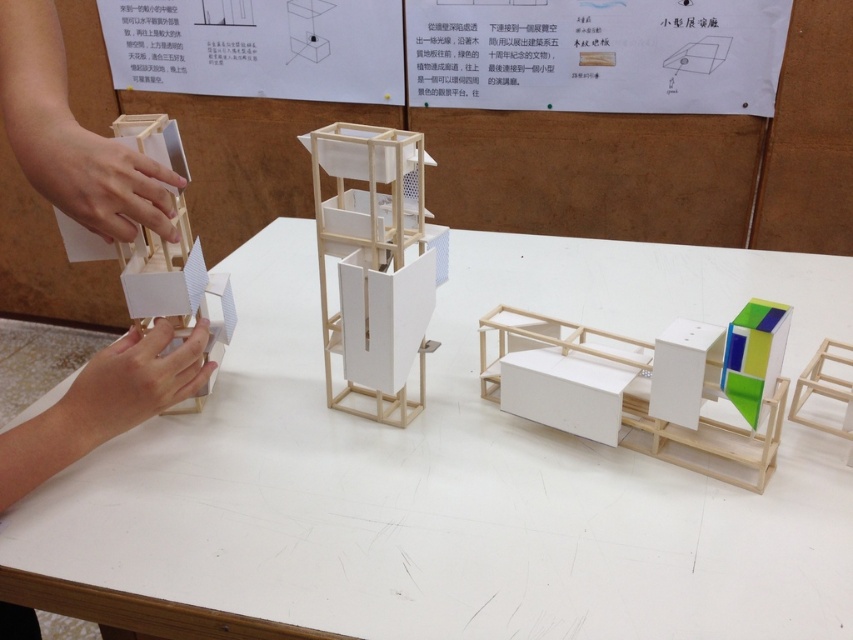
Question: Is white matte table at center above wooden model at left?

Choices:
 (A) no
 (B) yes

Answer: (A)

Question: Which point appears farthest from the camera in this image?

Choices:
 (A) (128, 413)
 (B) (635, 250)

Answer: (B)

Question: Which point is farther from the camera taking this photo?

Choices:
 (A) (165, 182)
 (B) (711, 516)

Answer: (A)

Question: Is white matte table at center above wooden model at left?

Choices:
 (A) yes
 (B) no

Answer: (B)

Question: Is white matte table at center closer to camera compared to wooden model at left?

Choices:
 (A) no
 (B) yes

Answer: (B)